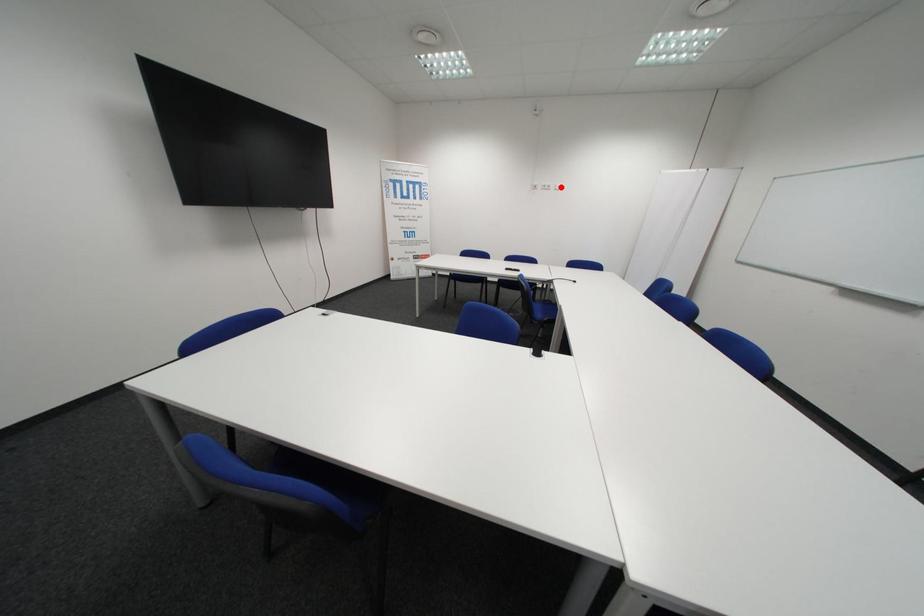
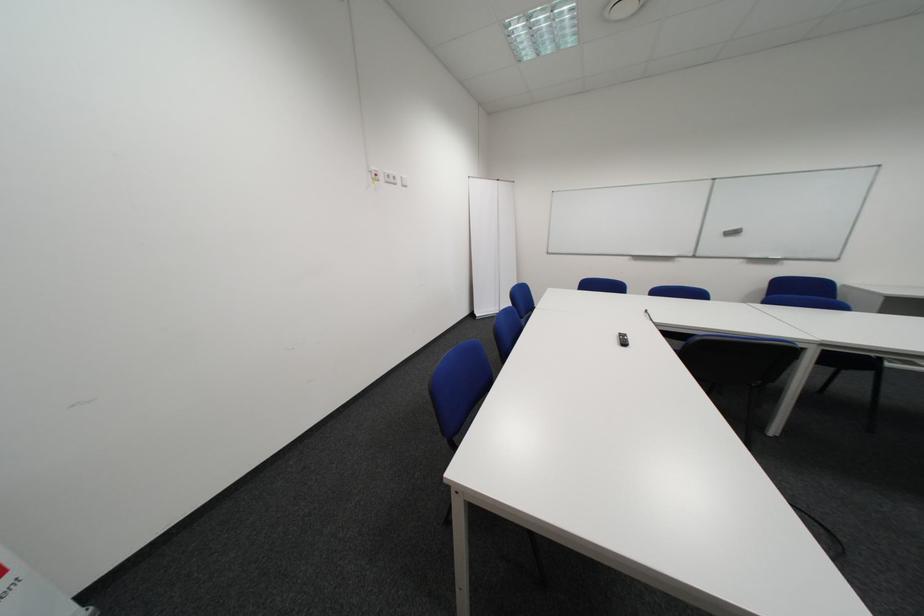
Find the pixel in the second image that matches the highlighted location in the first image.

(407, 179)